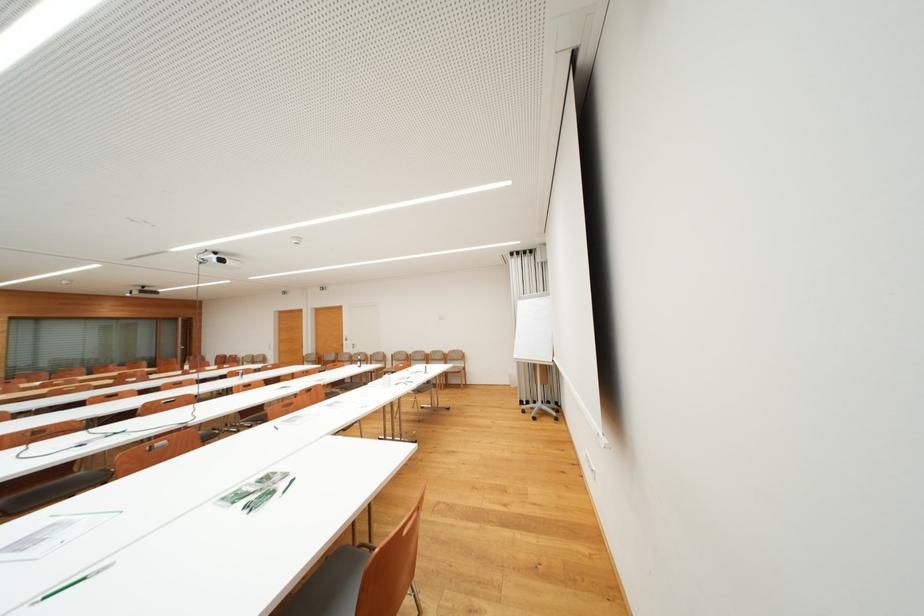
The width and height of the screenshot is (924, 616). Describe the element at coordinates (590, 244) in the screenshot. I see `the projector screen edge` at that location.